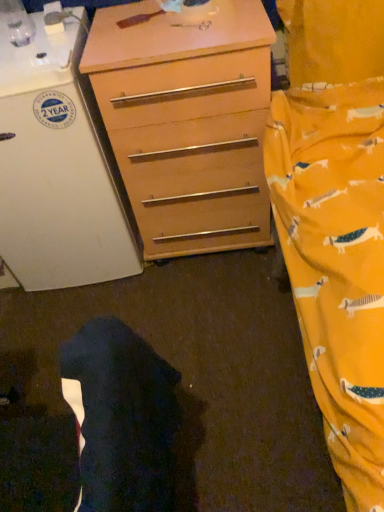
Identify the location of blank space above white matte refrigerator at left (from a real-world perspective). (23, 38).